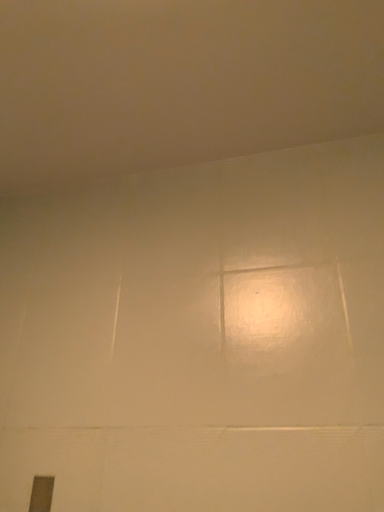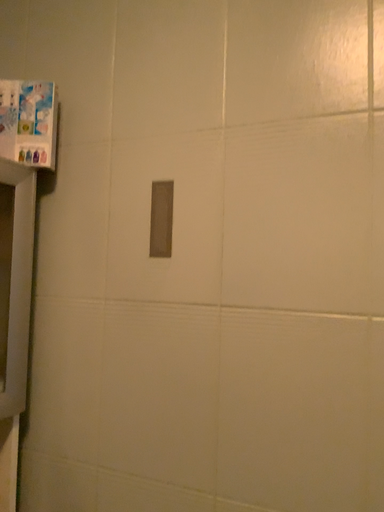
Question: How did the camera likely rotate when shooting the video?

Choices:
 (A) rotated downward
 (B) rotated upward

Answer: (A)